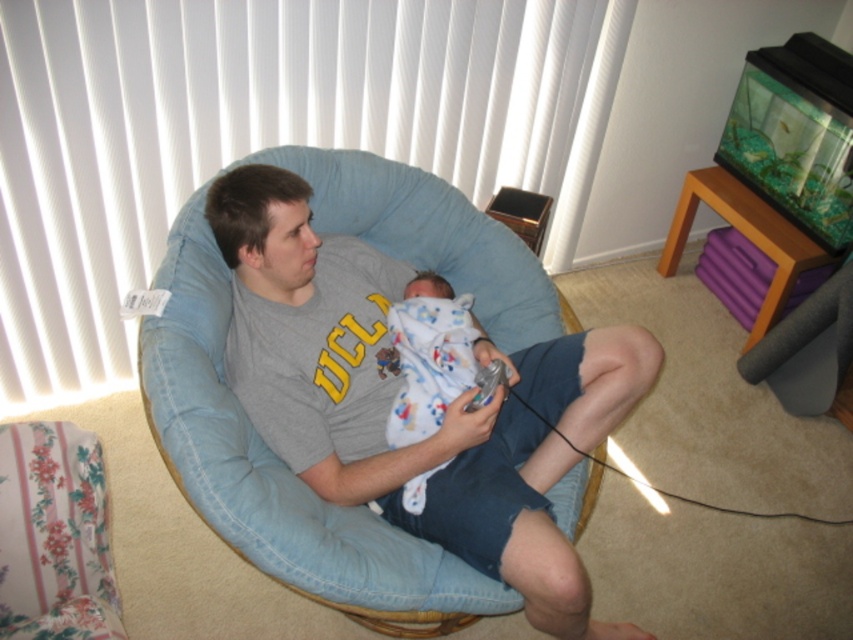
Question: Which point is farther to the camera?

Choices:
 (A) (467, 384)
 (B) (387, 387)
 (C) (483, 384)

Answer: (B)

Question: Where is denim blue chair at center located in relation to clear plastic game controller at lower center in the image?

Choices:
 (A) above
 (B) below

Answer: (B)

Question: Among these objects, which one is nearest to the camera?

Choices:
 (A) denim blue chair at center
 (B) white cotton swaddle at center

Answer: (A)

Question: Estimate the real-world distances between objects in this image. Which object is closer to the white cotton swaddle at center?

Choices:
 (A) denim blue chair at center
 (B) clear plastic game controller at lower center

Answer: (A)

Question: In this image, where is denim blue chair at center located relative to white cotton swaddle at center?

Choices:
 (A) below
 (B) above

Answer: (A)

Question: Can you confirm if white cotton swaddle at center is wider than clear plastic game controller at lower center?

Choices:
 (A) yes
 (B) no

Answer: (A)